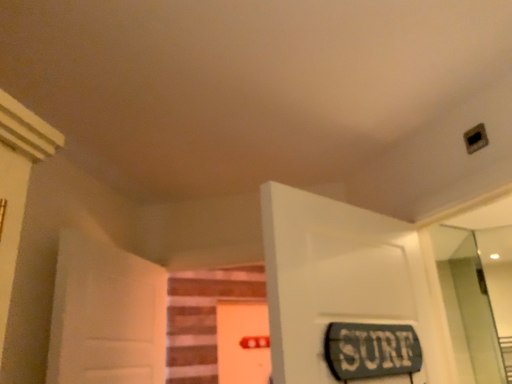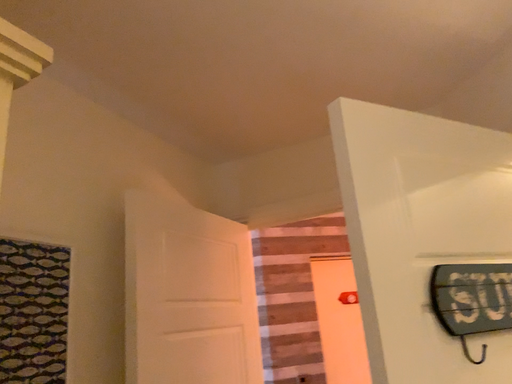
Question: How did the camera likely rotate when shooting the video?

Choices:
 (A) rotated left
 (B) rotated right

Answer: (A)